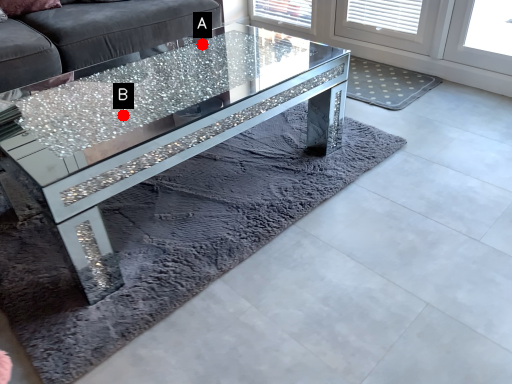
Question: Two points are circled on the image, labeled by A and B beside each circle. Which of the following is the farthest from the observer?

Choices:
 (A) A is further
 (B) B is further

Answer: (A)